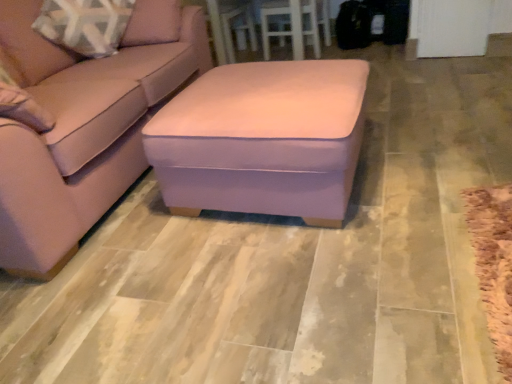
Describe the element at coordinates (84, 126) in the screenshot. Image resolution: width=512 pixels, height=384 pixels. I see `suede pink ottoman at center` at that location.

What do you see at coordinates (302, 24) in the screenshot? The image size is (512, 384). I see `white wood table at upper center` at bounding box center [302, 24].

Where is `pink velvet ottoman at center`? The height and width of the screenshot is (384, 512). pink velvet ottoman at center is located at coordinates (262, 139).

Identify the location of suede pink ottoman at center. (84, 126).

In the scene shown: Would you say white wood table at upper center is a long distance from suede pink ottoman at center?

white wood table at upper center is positioned a significant distance from suede pink ottoman at center.

Based on the photo, considering the sizes of white wood table at upper center and suede pink ottoman at center in the image, is white wood table at upper center bigger or smaller than suede pink ottoman at center?

white wood table at upper center is smaller than suede pink ottoman at center.

Considering the sizes of objects white wood table at upper center and suede pink ottoman at center in the image provided, who is taller, white wood table at upper center or suede pink ottoman at center?

suede pink ottoman at center is taller.

Is pink velvet ottoman at center wider than suede pink ottoman at center?

Incorrect, the width of pink velvet ottoman at center does not surpass that of suede pink ottoman at center.

How many degrees apart are the facing directions of pink velvet ottoman at center and suede pink ottoman at center?

There is a 0.000739-degree angle between the facing directions of pink velvet ottoman at center and suede pink ottoman at center.

From a real-world perspective, which object rests below the other?

pink velvet ottoman at center, from a real-world perspective.

Between pink velvet ottoman at center and suede pink ottoman at center, which one has less height?

pink velvet ottoman at center is shorter.

Which of these two, suede pink ottoman at center or white wood table at upper center, is smaller?

Smaller between the two is white wood table at upper center.

Which object is thinner, suede pink ottoman at center or white wood table at upper center?

Answer: With smaller width is white wood table at upper center.

In the image, is suede pink ottoman at center on the left side or the right side of white wood table at upper center?

In the image, suede pink ottoman at center appears on the left side of white wood table at upper center.

Is suede pink ottoman at center aimed at white wood table at upper center?

No, suede pink ottoman at center is not oriented towards white wood table at upper center.

Between point (23, 21) and point (173, 158), which one is positioned in front?

The point (173, 158) is closer.

From the image's perspective, is suede pink ottoman at center above pink velvet ottoman at center?

Indeed, from the image's perspective, suede pink ottoman at center is shown above pink velvet ottoman at center.

In terms of height, does suede pink ottoman at center look taller or shorter compared to pink velvet ottoman at center?

In the image, suede pink ottoman at center appears to be taller than pink velvet ottoman at center.

Are pink velvet ottoman at center and white wood table at upper center beside each other?

No, pink velvet ottoman at center is not in contact with white wood table at upper center.

Does pink velvet ottoman at center have a greater height compared to white wood table at upper center?

No.

In the image, there is a white wood table at upper center. Identify the location of stool below it (from a real-world perspective). (262, 139).

Considering the positions of objects pink velvet ottoman at center and white wood table at upper center in the image provided, who is behind, pink velvet ottoman at center or white wood table at upper center?

Positioned behind is white wood table at upper center.

From a real-world perspective, who is located higher, white wood table at upper center or pink velvet ottoman at center?

From a 3D spatial view, white wood table at upper center is above.

Who is taller, white wood table at upper center or pink velvet ottoman at center?

white wood table at upper center is taller.

Is point (277, 12) farther from viewer compared to point (288, 140)?

That is True.

Find the location of `table below the suede pink ottoman at center (from a real-world perspective)`. table below the suede pink ottoman at center (from a real-world perspective) is located at coordinates (302, 24).

In the image, there is a suede pink ottoman at center. Where is `stool below it (from the image's perspective)`? The width and height of the screenshot is (512, 384). stool below it (from the image's perspective) is located at coordinates (262, 139).

Based on their spatial positions, is white wood table at upper center or suede pink ottoman at center closer to pink velvet ottoman at center?

suede pink ottoman at center is closer to pink velvet ottoman at center.

Estimate the real-world distances between objects in this image. Which object is further from suede pink ottoman at center, white wood table at upper center or pink velvet ottoman at center?

white wood table at upper center lies further to suede pink ottoman at center than the other object.

From the image, which object appears to be farther from white wood table at upper center, pink velvet ottoman at center or suede pink ottoman at center?

Based on the image, pink velvet ottoman at center appears to be further to white wood table at upper center.

Estimate the real-world distances between objects in this image. Which object is further from pink velvet ottoman at center, suede pink ottoman at center or white wood table at upper center?

Among the two, white wood table at upper center is located further to pink velvet ottoman at center.

Considering their positions, is pink velvet ottoman at center positioned further to suede pink ottoman at center than white wood table at upper center?

white wood table at upper center.

Which object lies nearer to the anchor point white wood table at upper center, suede pink ottoman at center or pink velvet ottoman at center?

suede pink ottoman at center.

The height and width of the screenshot is (384, 512). Find the location of `stool between suede pink ottoman at center and white wood table at upper center along the z-axis`. stool between suede pink ottoman at center and white wood table at upper center along the z-axis is located at coordinates (262, 139).